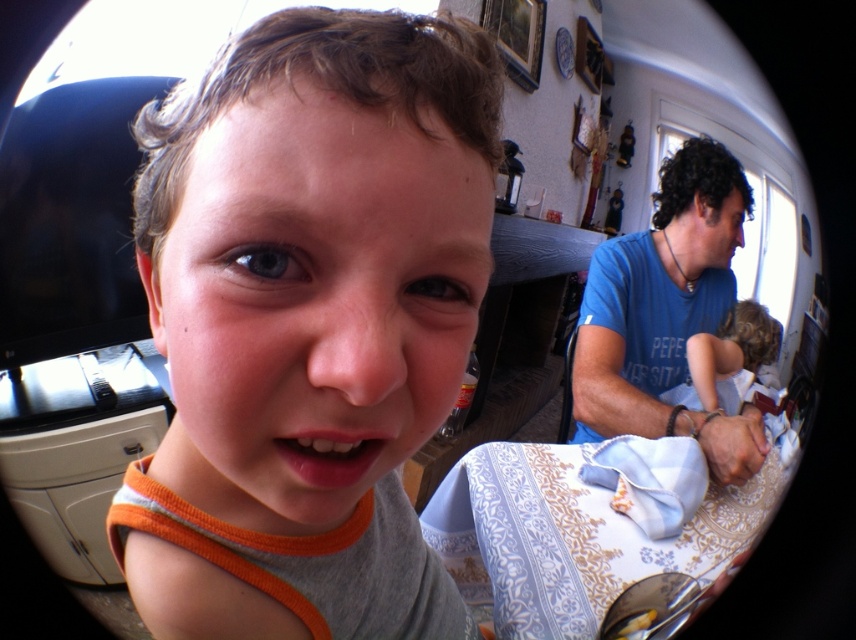
You are a photographer trying to adjust the focus on this image. Since the orange fabric shirt at center and the blonde hair at right are both in the scene, which one should you focus on to ensure the larger object remains sharp?

The blonde hair at right is larger in the image, so focusing on it would ensure the larger object remains sharp.

Based on the scene described, can you determine the spatial relationship between the blonde hair at right and the yellow matte bread at lower right?

The blonde hair at right is located above the yellow matte bread at lower right.

You are a photographer trying to adjust the focus of your camera. You notice two elements in the image that are both at the right side of the frame. Which one would require a larger adjustment to focus on due to its size? The elements are the blue cotton shirt at right and the blonde hair at right.

The blue cotton shirt at right is bigger than the blonde hair at right, so focusing on the blue cotton shirt at right would require a larger adjustment because it is larger in size.